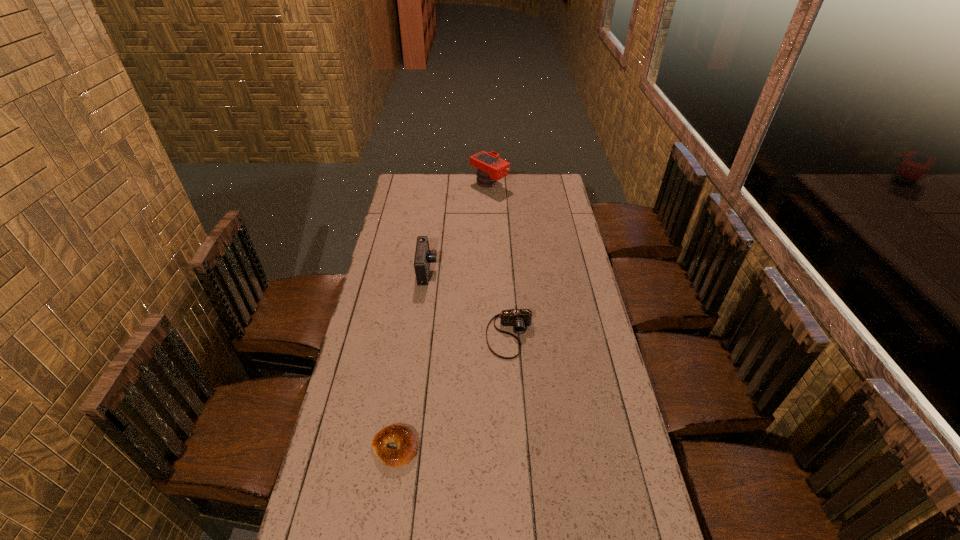
Find the location of a particular element. blank region between the tallest object and the third farthest object is located at coordinates tap(500, 260).

Locate an element on the screen. This screenshot has height=540, width=960. free space between the bagel and the second nearest camera is located at coordinates (411, 360).

Find the location of a particular element. The height and width of the screenshot is (540, 960). vacant area that lies between the nearest object and the leftmost camera is located at coordinates (411, 360).

Locate an element on the screen. This screenshot has width=960, height=540. free point between the nearest camera and the bagel is located at coordinates (452, 392).

You are a GUI agent. You are given a task and a screenshot of the screen. Output one action in this format:
    pyautogui.click(x=<x>, y=<y>)
    Task: Click on the object that ranks as the second closest to the leftmost camera
    The width and height of the screenshot is (960, 540).
    Given the screenshot: What is the action you would take?
    pyautogui.click(x=490, y=167)

Select which object appears as the closest to the shortest camera. Please provide its 2D coordinates. Your answer should be formatted as a tuple, i.e. [(x, y)], where the tuple contains the x and y coordinates of a point satisfying the conditions above.

[(424, 256)]

I want to click on the closest camera to the nearest object, so click(x=520, y=318).

Image resolution: width=960 pixels, height=540 pixels. What are the coordinates of `camera that stands as the closest to the shortest camera` in the screenshot? It's located at point(424,256).

Image resolution: width=960 pixels, height=540 pixels. Identify the location of vacant space that satisfies the following two spatial constraints: 1. on the back side of the tallest object; 2. on the right side of the nearest object. (434, 185).

Where is `free location that satisfies the following two spatial constraints: 1. on the front-facing side of the third shortest object; 2. on the front side of the shortest object`? This screenshot has height=540, width=960. free location that satisfies the following two spatial constraints: 1. on the front-facing side of the third shortest object; 2. on the front side of the shortest object is located at coordinates (403, 448).